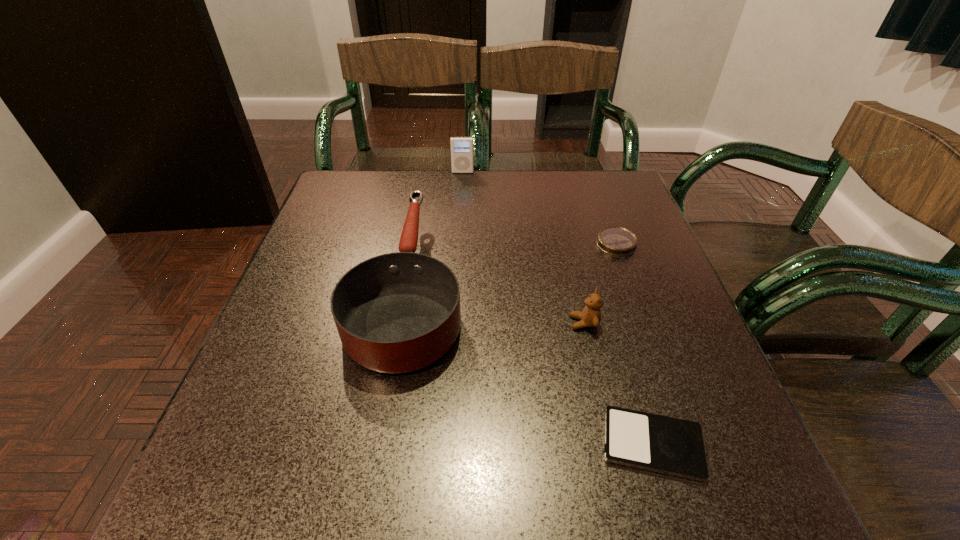
The image size is (960, 540). Find the location of `free region that satisfies the following two spatial constraints: 1. on the front-facing side of the shortest object; 2. on the left side of the third shortest object`. free region that satisfies the following two spatial constraints: 1. on the front-facing side of the shortest object; 2. on the left side of the third shortest object is located at coordinates (612, 444).